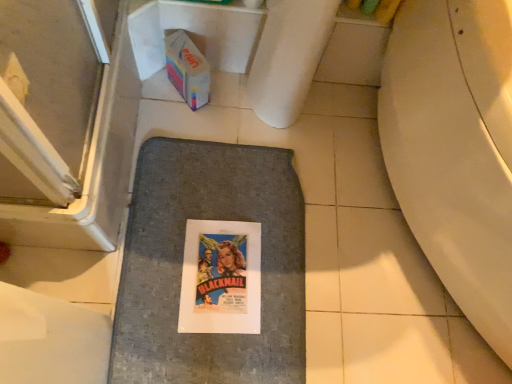
Identify the location of vacant area situated below gray fabric bath mat at center (from a real-world perspective). This screenshot has width=512, height=384. (214, 269).